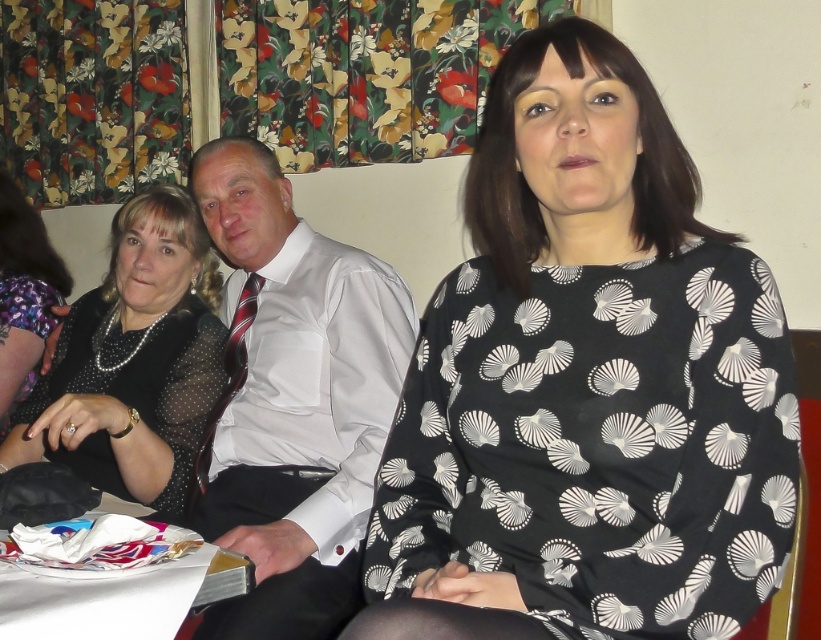
Which is below, black printed blouse at center or black sheer dress at left?

black sheer dress at left

The width and height of the screenshot is (821, 640). I want to click on black printed blouse at center, so click(x=585, y=385).

Locate an element on the screen. black printed blouse at center is located at coordinates (585, 385).

Can you confirm if white satin shirt at center is thinner than black sheer dress at left?

Yes.

Who is positioned more to the right, white satin shirt at center or black sheer dress at left?

From the viewer's perspective, white satin shirt at center appears more on the right side.

Looking at this image, measure the distance between point (x=365, y=480) and camera.

They are 1.61 meters apart.

Where is `white satin shirt at center`? white satin shirt at center is located at coordinates point(292,401).

Which is behind, point (539, 536) or point (299, 256)?

The point (299, 256) is more distant.

Who is positioned more to the left, black printed blouse at center or white satin shirt at center?

white satin shirt at center is more to the left.

Is point (576, 145) positioned after point (264, 180)?

No, (576, 145) is closer to viewer.

Find the location of `black printed blouse at center`. black printed blouse at center is located at coordinates (585, 385).